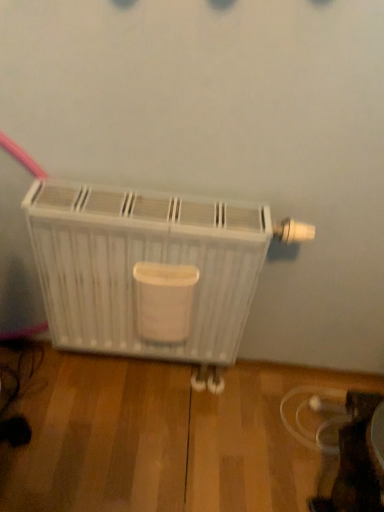
Question: Should I look upward or downward to see white plastic radiator at center?

Choices:
 (A) down
 (B) up

Answer: (A)